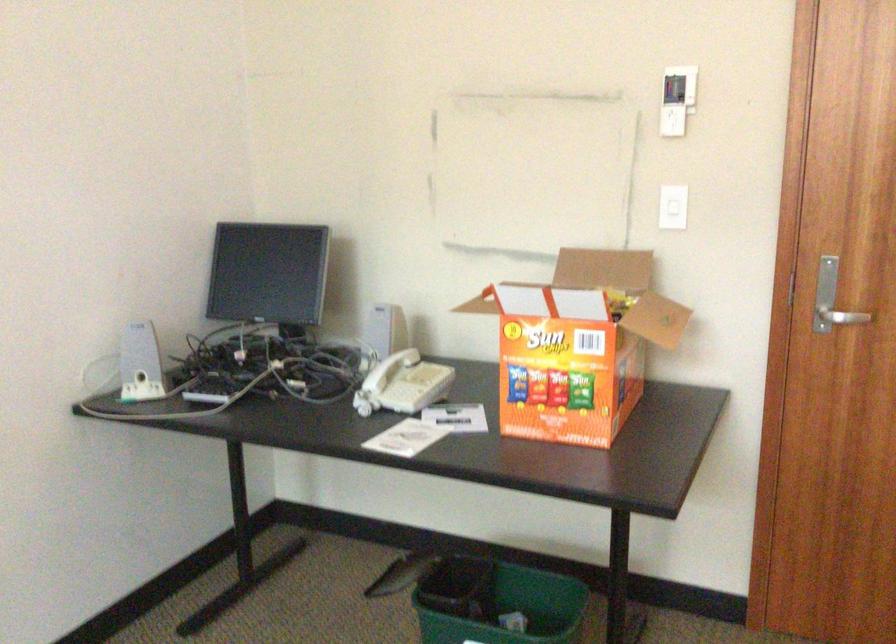
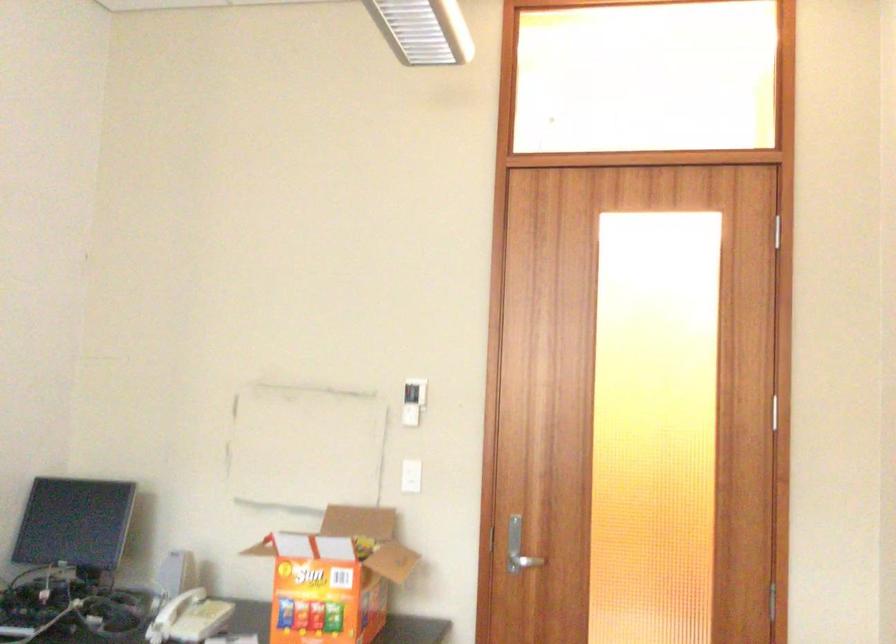
Find the pixel in the second image that matches point (583, 344) in the first image.

(334, 576)